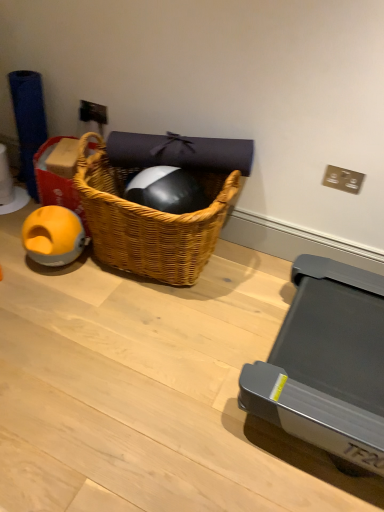
This screenshot has width=384, height=512. In order to click on free space on the front side of orange rubber ball at left in this screenshot , I will do `click(50, 291)`.